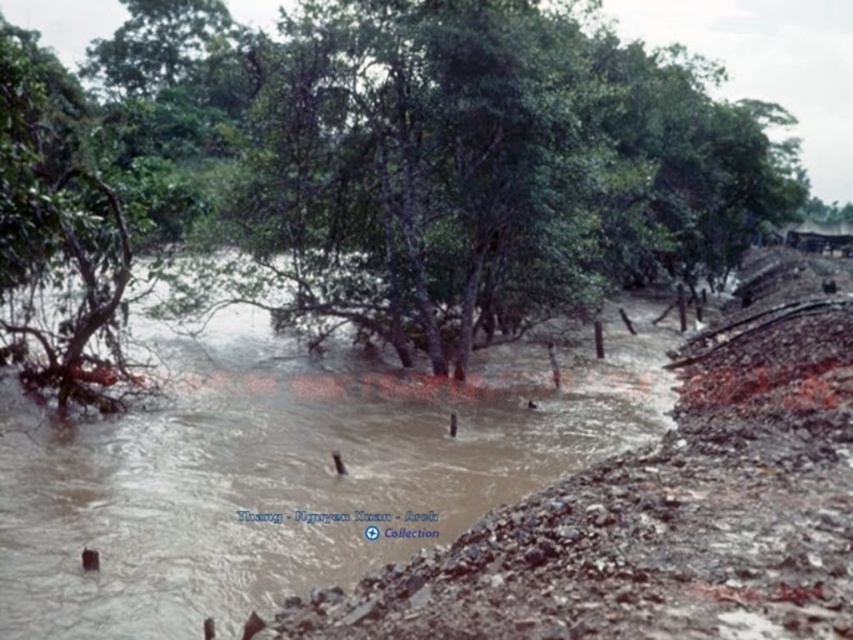
Question: Does green matte tree at center have a smaller size compared to brown muddy water at center?

Choices:
 (A) yes
 (B) no

Answer: (B)

Question: Is green matte tree at center further to camera compared to brown muddy water at center?

Choices:
 (A) yes
 (B) no

Answer: (A)

Question: Does green matte tree at center have a smaller size compared to brown muddy water at center?

Choices:
 (A) no
 (B) yes

Answer: (A)

Question: Among these objects, which one is farthest from the camera?

Choices:
 (A) brown muddy water at center
 (B) green matte tree at center

Answer: (B)

Question: Which point is closer to the camera?

Choices:
 (A) [254, 76]
 (B) [180, 436]

Answer: (B)

Question: Which point is closer to the camera?

Choices:
 (A) brown muddy water at center
 (B) green matte tree at center

Answer: (A)